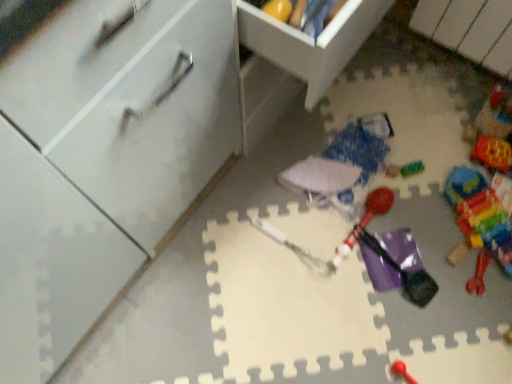
Question: Could rubberized red mallet at center, the 2th toy from the left, be considered to be inside translucent plastic blocks at lower right, the first toy viewed from the right?

Choices:
 (A) yes
 (B) no

Answer: (B)

Question: From the image's perspective, does translucent plastic blocks at lower right, acting as the 7th toy starting from the left, appear higher than rubberized red mallet at center, the sixth toy in the right-to-left sequence?

Choices:
 (A) yes
 (B) no

Answer: (A)

Question: Is translucent plastic blocks at lower right, the first toy viewed from the right, aimed at rubberized red mallet at center, the sixth toy in the right-to-left sequence?

Choices:
 (A) no
 (B) yes

Answer: (A)

Question: From a real-world perspective, is translucent plastic blocks at lower right, the first toy viewed from the right, below rubberized red mallet at center, the sixth toy in the right-to-left sequence?

Choices:
 (A) no
 (B) yes

Answer: (B)

Question: Is translucent plastic blocks at lower right, the first toy viewed from the right, smaller than rubberized red mallet at center, the 2th toy from the left?

Choices:
 (A) no
 (B) yes

Answer: (B)

Question: Considering the positions of point (495, 221) and point (465, 251), is point (495, 221) closer or farther from the camera than point (465, 251)?

Choices:
 (A) closer
 (B) farther

Answer: (B)

Question: From a real-world perspective, is translucent plastic blocks at lower right, the first toy viewed from the right, positioned above or below multicolored plastic blocks at right, which is the 2th toy in right-to-left order?

Choices:
 (A) below
 (B) above

Answer: (A)

Question: Considering the positions of translucent plastic blocks at lower right, the first toy viewed from the right, and multicolored plastic blocks at right, which is the 2th toy in right-to-left order, in the image, is translucent plastic blocks at lower right, the first toy viewed from the right, wider or thinner than multicolored plastic blocks at right, which is the 2th toy in right-to-left order,?

Choices:
 (A) wide
 (B) thin

Answer: (B)

Question: Do you think translucent plastic blocks at lower right, acting as the 7th toy starting from the left, is within multicolored plastic blocks at right, which is the 2th toy in right-to-left order, or outside of it?

Choices:
 (A) outside
 (B) inside

Answer: (B)

Question: In terms of size, does translucent plastic blocks at lower right, acting as the 7th toy starting from the left, appear bigger or smaller than white fabric umbrella at center, placed as the 7th toy when sorted from right to left?

Choices:
 (A) small
 (B) big

Answer: (A)

Question: Is translucent plastic blocks at lower right, acting as the 7th toy starting from the left, in front of or behind white fabric umbrella at center, positioned as the first toy in left-to-right order, in the image?

Choices:
 (A) front
 (B) behind

Answer: (A)

Question: From a real-world perspective, is translucent plastic blocks at lower right, acting as the 7th toy starting from the left, positioned above or below white fabric umbrella at center, positioned as the first toy in left-to-right order?

Choices:
 (A) above
 (B) below

Answer: (B)

Question: From the image's perspective, relative to white fabric umbrella at center, placed as the 7th toy when sorted from right to left, is translucent plastic blocks at lower right, the first toy viewed from the right, above or below?

Choices:
 (A) below
 (B) above

Answer: (A)

Question: Is translucent plastic bag at center, positioned as the 3th toy in left-to-right order, in front of or behind translucent plastic blocks at lower right, acting as the 7th toy starting from the left, in the image?

Choices:
 (A) behind
 (B) front

Answer: (A)

Question: Would you say translucent plastic bag at center, positioned as the 3th toy in left-to-right order, is to the left or to the right of translucent plastic blocks at lower right, acting as the 7th toy starting from the left, in the picture?

Choices:
 (A) right
 (B) left

Answer: (B)